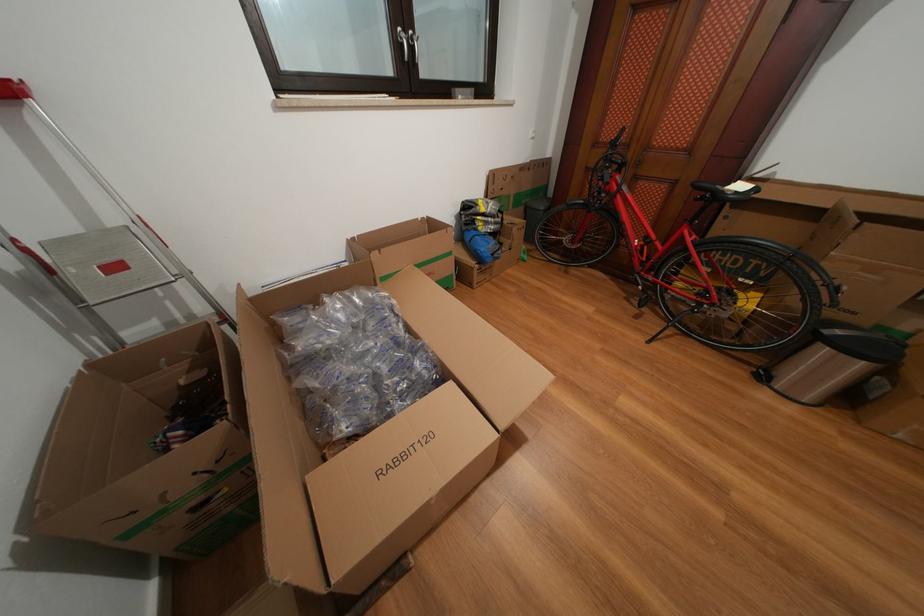
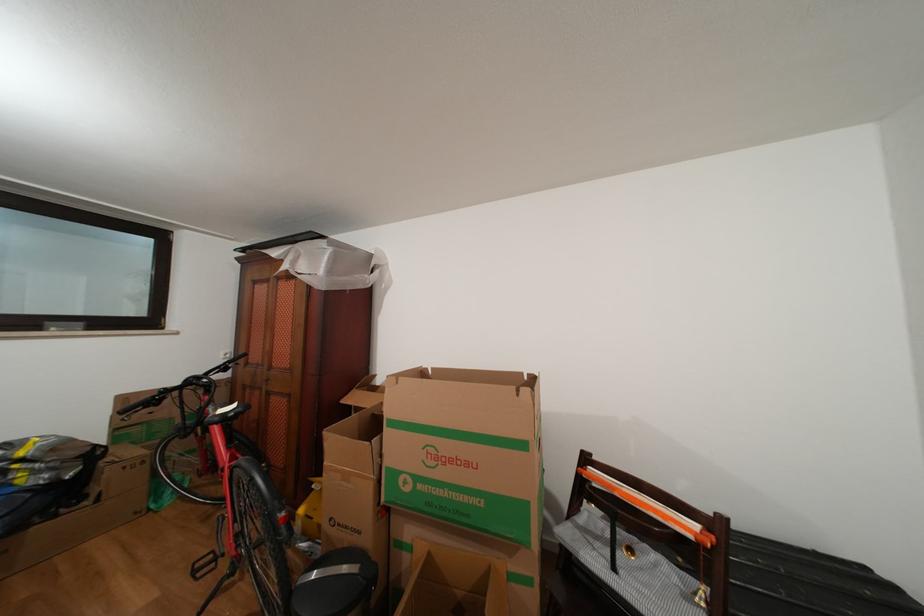
The point at (465, 95) is marked in the first image. Where is the corresponding point in the second image?

(56, 329)